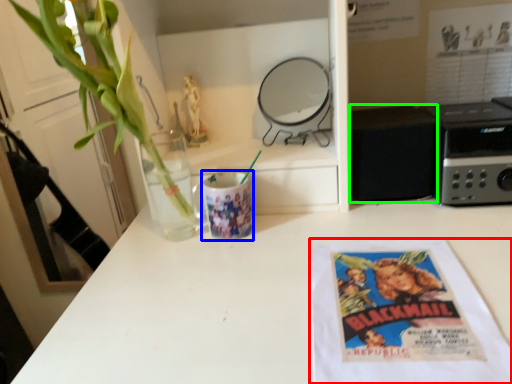
Question: Based on their relative distances, which object is nearer to paperback book (highlighted by a red box)? Choose from mug (highlighted by a blue box) and appliance (highlighted by a green box).

Choices:
 (A) mug
 (B) appliance

Answer: (B)